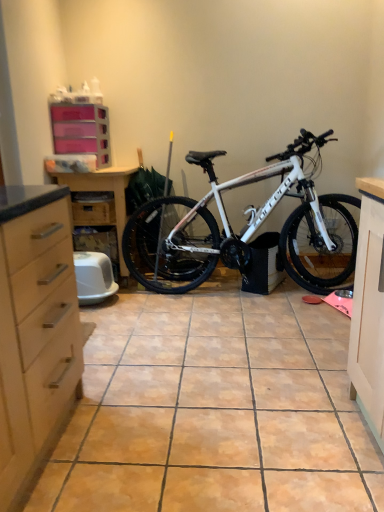
Question: Is matte wood dresser at left bigger than white matte bicycle at center?

Choices:
 (A) yes
 (B) no

Answer: (B)

Question: Could you tell me if matte wood dresser at left is facing white matte bicycle at center?

Choices:
 (A) no
 (B) yes

Answer: (A)

Question: Is white matte bicycle at center located within matte wood dresser at left?

Choices:
 (A) yes
 (B) no

Answer: (B)

Question: Does matte wood dresser at left lie behind white matte bicycle at center?

Choices:
 (A) no
 (B) yes

Answer: (B)

Question: Is matte wood dresser at left shorter than white matte bicycle at center?

Choices:
 (A) no
 (B) yes

Answer: (B)

Question: From the image's perspective, would you say matte wood dresser at left is positioned over white matte bicycle at center?

Choices:
 (A) no
 (B) yes

Answer: (A)

Question: Is matte wood dresser at left not near pink plastic drawers at upper left?

Choices:
 (A) no
 (B) yes

Answer: (A)

Question: Does matte wood dresser at left have a smaller size compared to pink plastic drawers at upper left?

Choices:
 (A) no
 (B) yes

Answer: (A)

Question: Can you confirm if matte wood dresser at left is bigger than pink plastic drawers at upper left?

Choices:
 (A) no
 (B) yes

Answer: (B)

Question: Considering the relative positions of matte wood dresser at left and pink plastic drawers at upper left in the image provided, is matte wood dresser at left to the right of pink plastic drawers at upper left from the viewer's perspective?

Choices:
 (A) yes
 (B) no

Answer: (A)

Question: Is the surface of matte wood dresser at left in direct contact with pink plastic drawers at upper left?

Choices:
 (A) yes
 (B) no

Answer: (B)

Question: From a real-world perspective, is matte wood dresser at left physically above pink plastic drawers at upper left?

Choices:
 (A) yes
 (B) no

Answer: (B)

Question: Does wooden drawer at center-left contain matte wood dresser at left?

Choices:
 (A) yes
 (B) no

Answer: (B)